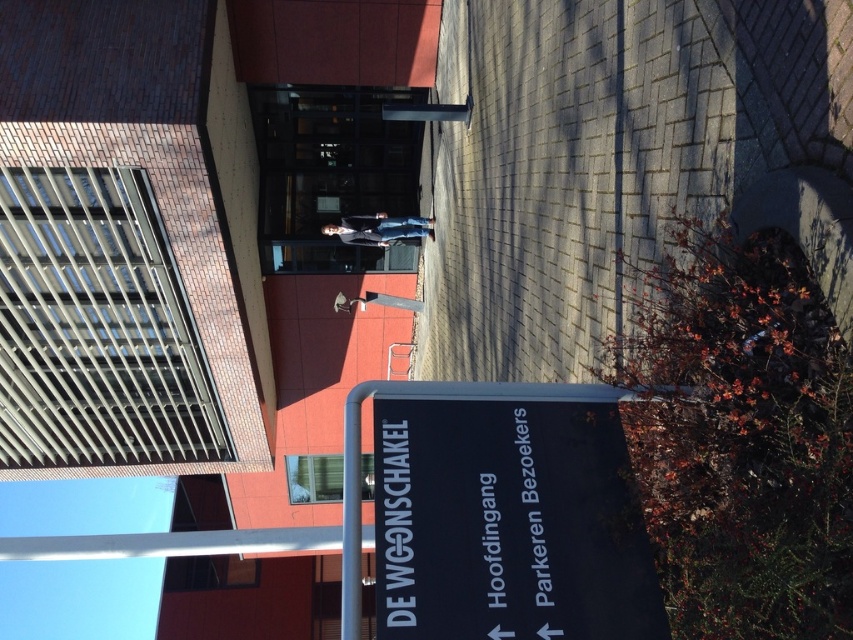
You are a visitor at the building and need to find the main entrance. You see the black plastic sign at center and the metallic gray pole at center. Which object is wider?

The black plastic sign at center has a lesser width compared to metallic gray pole at center, so the metallic gray pole at center is wider.